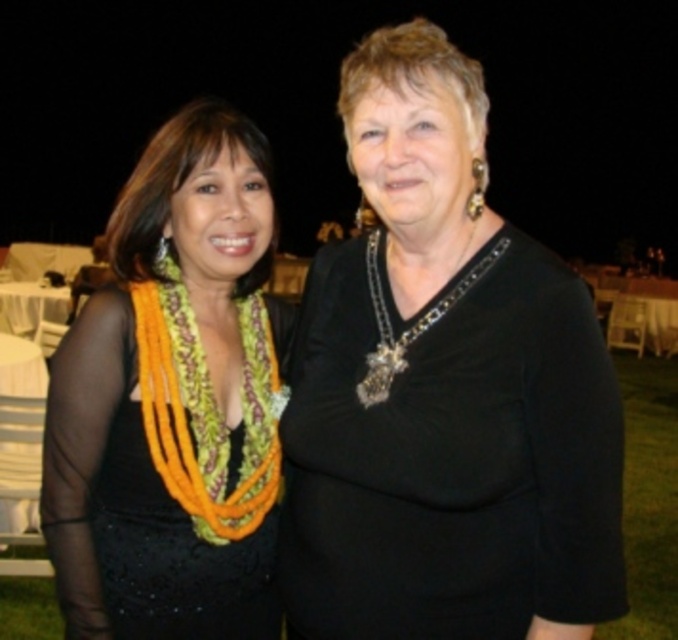
Is black velvet dress at center above silver metallic chain at center?

No.

Which is more to the right, black velvet dress at center or silver metallic chain at center?

→ Positioned to the right is black velvet dress at center.

Who is more distant from viewer, (358, 138) or (416, 333)?

Point (416, 333)

Find the location of a particular element. black velvet dress at center is located at coordinates (443, 390).

Can you confirm if black matte dress at left is wider than multicolored woven lei at center?

Indeed, black matte dress at left has a greater width compared to multicolored woven lei at center.

Can you confirm if black matte dress at left is positioned to the left of multicolored woven lei at center?

Indeed, black matte dress at left is positioned on the left side of multicolored woven lei at center.

Measure the distance between black matte dress at left and camera.

black matte dress at left and camera are 4.54 feet apart from each other.

At what (x,y) coordinates should I click in order to perform the action: click on black matte dress at left. Please return your answer as a coordinate pair (x, y). Looking at the image, I should click on (180, 403).

Which is behind, point (121, 230) or point (378, 355)?

Point (121, 230)

Can you confirm if black matte dress at left is shorter than silver metallic chain at center?

No, black matte dress at left is not shorter than silver metallic chain at center.

Is point (247, 490) less distant than point (382, 372)?

That is False.

Identify the location of black matte dress at left. The width and height of the screenshot is (678, 640). (180, 403).